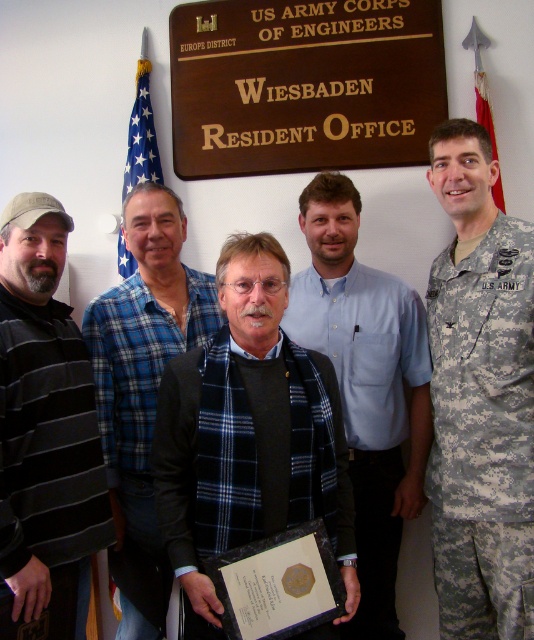
Question: Does camouflage uniform at center have a greater width compared to blue plaid shirt at center?

Choices:
 (A) yes
 (B) no

Answer: (B)

Question: Which point is farther to the camera?

Choices:
 (A) (300, 216)
 (B) (458, 182)

Answer: (A)

Question: Estimate the real-world distances between objects in this image. Which object is closer to the blue plaid shirt at center?

Choices:
 (A) blue shirt at center
 (B) camouflage uniform at center
 (C) black striped sweater at left
 (D) black matte uniform at center

Answer: (C)

Question: Considering the relative positions of camouflage uniform at center and blue shirt at center in the image provided, where is camouflage uniform at center located with respect to blue shirt at center?

Choices:
 (A) below
 (B) above

Answer: (B)

Question: Can you confirm if black striped sweater at left is positioned to the right of blue shirt at center?

Choices:
 (A) no
 (B) yes

Answer: (A)

Question: Which point is closer to the camera taking this photo?

Choices:
 (A) (365, 406)
 (B) (36, 596)

Answer: (B)